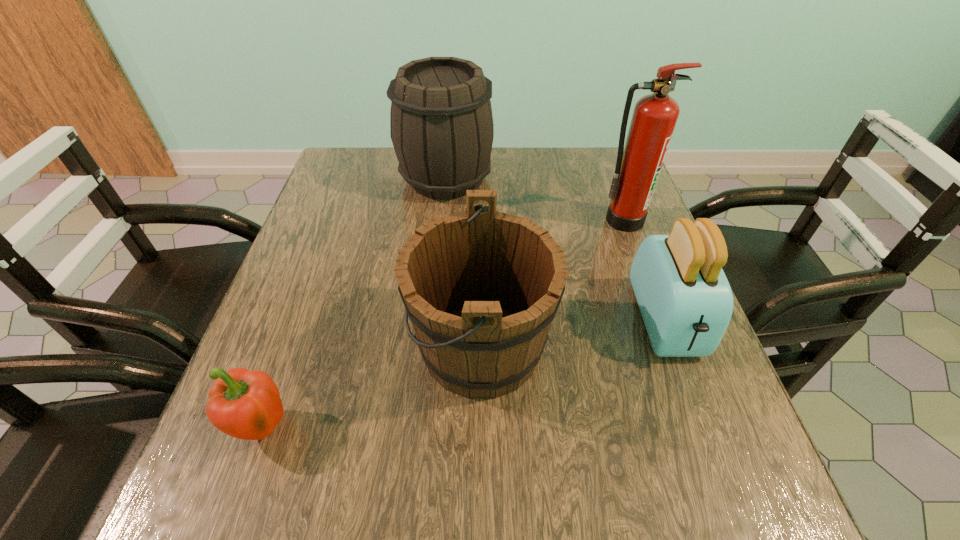
Locate an element on the screen. This screenshot has width=960, height=540. free space at the right edge is located at coordinates (647, 364).

What are the coordinates of `vacant area at the far left corner of the desktop` in the screenshot? It's located at (352, 151).

In the image, there is a desktop. Where is `vacant space at the near left corner`? vacant space at the near left corner is located at coordinates (252, 499).

In the image, there is a desktop. Where is `free region at the near right corner`? Image resolution: width=960 pixels, height=540 pixels. free region at the near right corner is located at coordinates pyautogui.click(x=726, y=526).

At what (x,y) coordinates should I click in order to perform the action: click on free area in between the nearer wine bucket and the leftmost object. Please return your answer as a coordinate pair (x, y). The width and height of the screenshot is (960, 540). Looking at the image, I should click on (372, 388).

The height and width of the screenshot is (540, 960). What are the coordinates of `free space that is in between the nearer wine bucket and the toaster` in the screenshot? It's located at (573, 334).

Find the location of `object that is the third nearest to the shortest object`. object that is the third nearest to the shortest object is located at coordinates (686, 302).

What are the coordinates of `the second closest object to the pepper` in the screenshot? It's located at (441, 125).

The height and width of the screenshot is (540, 960). Find the location of `vacant space that satisfies the following two spatial constraints: 1. on the side of the toaster with the lever; 2. on the side of the nearer wine bucket with the handle for carrying`. vacant space that satisfies the following two spatial constraints: 1. on the side of the toaster with the lever; 2. on the side of the nearer wine bucket with the handle for carrying is located at coordinates (675, 347).

This screenshot has width=960, height=540. I want to click on free point that satisfies the following two spatial constraints: 1. on the back side of the shortest object; 2. on the right side of the farther wine bucket, so click(x=352, y=178).